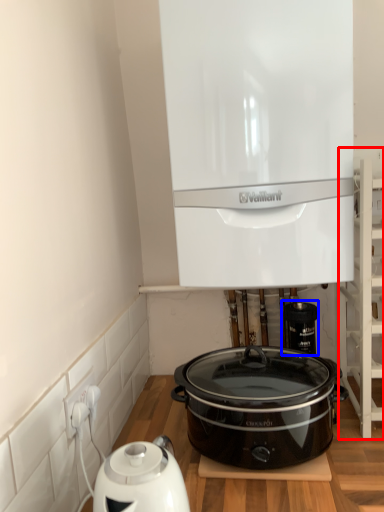
Question: Which of the following is the closest to the observer, shelf (highlighted by a red box) or appliance (highlighted by a blue box)?

Choices:
 (A) shelf
 (B) appliance

Answer: (A)